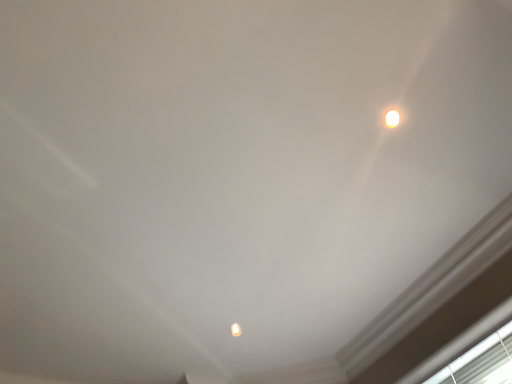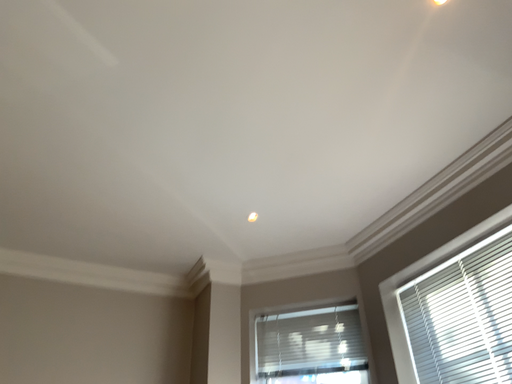
Question: How did the camera likely rotate when shooting the video?

Choices:
 (A) rotated upward
 (B) rotated downward

Answer: (B)